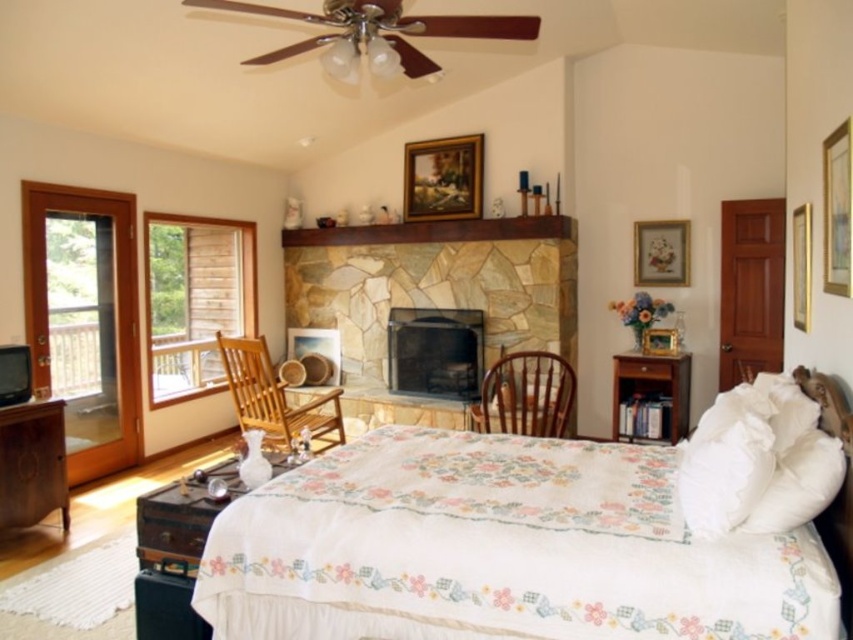
Question: Observing the image, what is the correct spatial positioning of floral embroidered quilt at center in reference to brown wood nightstand at lower right?

Choices:
 (A) above
 (B) below

Answer: (B)

Question: Can you confirm if wooden dresser at lower left is bigger than matte gold picture frame at upper right?

Choices:
 (A) yes
 (B) no

Answer: (A)

Question: Among these points, which one is nearest to the camera?

Choices:
 (A) (793, 525)
 (B) (230, 342)
 (C) (625, 557)
 (D) (410, 353)

Answer: (C)

Question: Is wooden dresser at lower left smaller than brown wooden chair at center?

Choices:
 (A) no
 (B) yes

Answer: (B)

Question: Which of the following is the closest to the observer?

Choices:
 (A) (554, 552)
 (B) (39, 324)
 (C) (788, 477)

Answer: (A)

Question: Which point is closer to the camera taking this photo?

Choices:
 (A) (642, 243)
 (B) (44, 289)

Answer: (B)